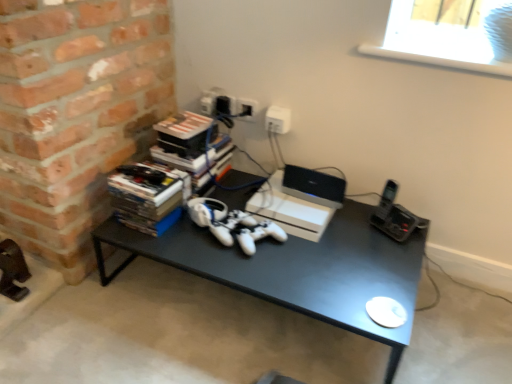
At what (x,y) coordinates should I click in order to perform the action: click on free point to the left of white plastic laptop at center. Please return your answer as a coordinate pair (x, y). Looking at the image, I should click on (279, 198).